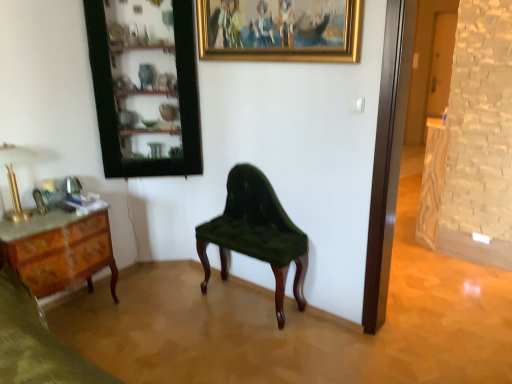
Locate an element on the screen. This screenshot has height=384, width=512. vacant area that lies between marble top wood desk at left and velvet green chair at center is located at coordinates (166, 315).